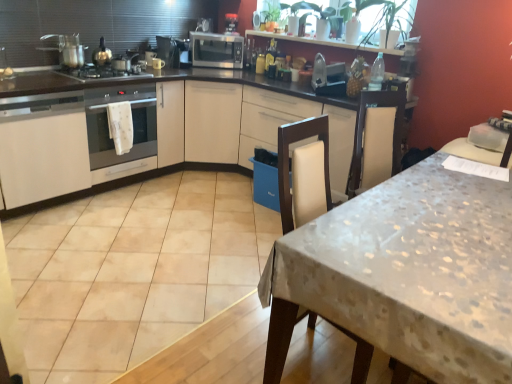
Question: Considering the relative sizes of satin silver gas stove at left and white glossy cabinet at left in the image provided, is satin silver gas stove at left taller than white glossy cabinet at left?

Choices:
 (A) no
 (B) yes

Answer: (A)

Question: From the image's perspective, is satin silver gas stove at left located beneath white glossy cabinet at left?

Choices:
 (A) yes
 (B) no

Answer: (B)

Question: Can you confirm if satin silver gas stove at left is positioned to the right of white glossy cabinet at left?

Choices:
 (A) yes
 (B) no

Answer: (A)

Question: Is satin silver gas stove at left surrounding white glossy cabinet at left?

Choices:
 (A) yes
 (B) no

Answer: (B)

Question: Are satin silver gas stove at left and white glossy cabinet at left located far from each other?

Choices:
 (A) yes
 (B) no

Answer: (B)

Question: Does satin silver gas stove at left come behind white glossy cabinet at left?

Choices:
 (A) no
 (B) yes

Answer: (B)

Question: Is the depth of white fabric towel at left greater than that of white glossy cabinet at left?

Choices:
 (A) yes
 (B) no

Answer: (A)

Question: Considering the relative sizes of white fabric towel at left and white glossy cabinet at left in the image provided, is white fabric towel at left thinner than white glossy cabinet at left?

Choices:
 (A) yes
 (B) no

Answer: (A)

Question: Is white fabric towel at left outside of white glossy cabinet at left?

Choices:
 (A) no
 (B) yes

Answer: (B)

Question: From the image's perspective, is white fabric towel at left located beneath white glossy cabinet at left?

Choices:
 (A) no
 (B) yes

Answer: (A)

Question: From a real-world perspective, is white fabric towel at left physically above white glossy cabinet at left?

Choices:
 (A) yes
 (B) no

Answer: (A)

Question: From the image's perspective, is white fabric towel at left on white glossy cabinet at left?

Choices:
 (A) no
 (B) yes

Answer: (B)

Question: Is the depth of satin silver gas stove at left less than that of metallic silver toaster at upper center, which is counted as the 3th appliance, starting from the top?

Choices:
 (A) no
 (B) yes

Answer: (B)